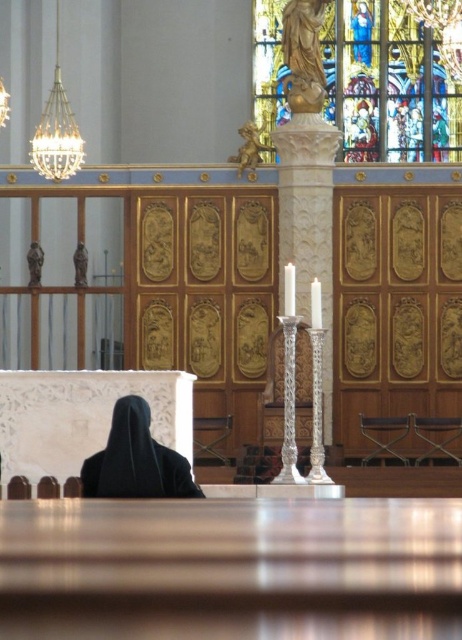
You are standing in the church and want to place a small flower vase between the gold polished statue at upper center and the white porcelain candle at center. Which object should the vase be closer to if it needs to be placed at the same height as the candle?

The vase should be placed closer to the white porcelain candle at center because the gold polished statue at upper center is much taller than the white porcelain candle at center, so positioning the vase near the shorter candle would maintain the desired height level.

You are an interior designer planning to place a new statue in the church. The statue requires a base that must be wider than the black matte robe at lower left. Can the base be placed where the white glossy candle at center currently is?

The black matte robe at lower left is wider than the white glossy candle at center. Since the statue base needs to be wider than the robe, it cannot fit in the candle area, which is narrower.

You are standing at the altar in the church and want to light the white glossy candle at center. The black matte robe at lower left is blocking your path. Can you reach the candle without moving the robe?

The black matte robe at lower left and white glossy candle at center are 13.51 meters apart. Since the distance is quite large, you can likely reach the candle without needing to move the robe as they are far apart.